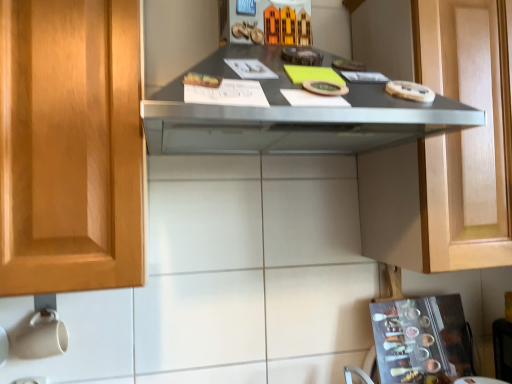
Question: Can you confirm if metallic silver spice rack at lower right is shorter than matte gray countertop at center?

Choices:
 (A) no
 (B) yes

Answer: (B)

Question: Is matte gray countertop at center completely or partially inside metallic silver spice rack at lower right?

Choices:
 (A) no
 (B) yes

Answer: (A)

Question: From a real-world perspective, is metallic silver spice rack at lower right positioned under matte gray countertop at center based on gravity?

Choices:
 (A) no
 (B) yes

Answer: (B)

Question: Can you confirm if metallic silver spice rack at lower right is bigger than matte gray countertop at center?

Choices:
 (A) yes
 (B) no

Answer: (B)

Question: Is metallic silver spice rack at lower right at the right side of matte gray countertop at center?

Choices:
 (A) yes
 (B) no

Answer: (A)

Question: Does metallic silver spice rack at lower right have a greater width compared to matte gray countertop at center?

Choices:
 (A) yes
 (B) no

Answer: (B)

Question: From the image's perspective, is metallic silver spice rack at lower right above matte wood cabinet at upper right?

Choices:
 (A) yes
 (B) no

Answer: (B)

Question: Can you confirm if metallic silver spice rack at lower right is thinner than matte wood cabinet at upper right?

Choices:
 (A) yes
 (B) no

Answer: (A)

Question: Can you confirm if metallic silver spice rack at lower right is positioned to the left of matte wood cabinet at upper right?

Choices:
 (A) no
 (B) yes

Answer: (B)

Question: Is metallic silver spice rack at lower right bigger than matte wood cabinet at upper right?

Choices:
 (A) no
 (B) yes

Answer: (A)

Question: Is metallic silver spice rack at lower right further to the viewer compared to matte wood cabinet at upper right?

Choices:
 (A) no
 (B) yes

Answer: (B)

Question: Can you confirm if metallic silver spice rack at lower right is smaller than matte wood cabinet at upper right?

Choices:
 (A) yes
 (B) no

Answer: (A)

Question: Are matte gray countertop at center and metallic silver spice rack at lower right beside each other?

Choices:
 (A) no
 (B) yes

Answer: (A)